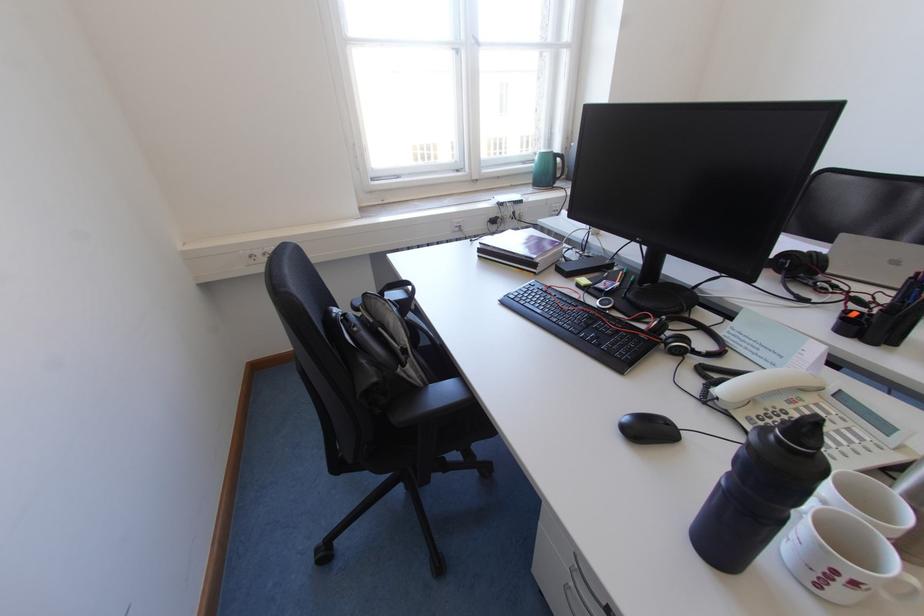
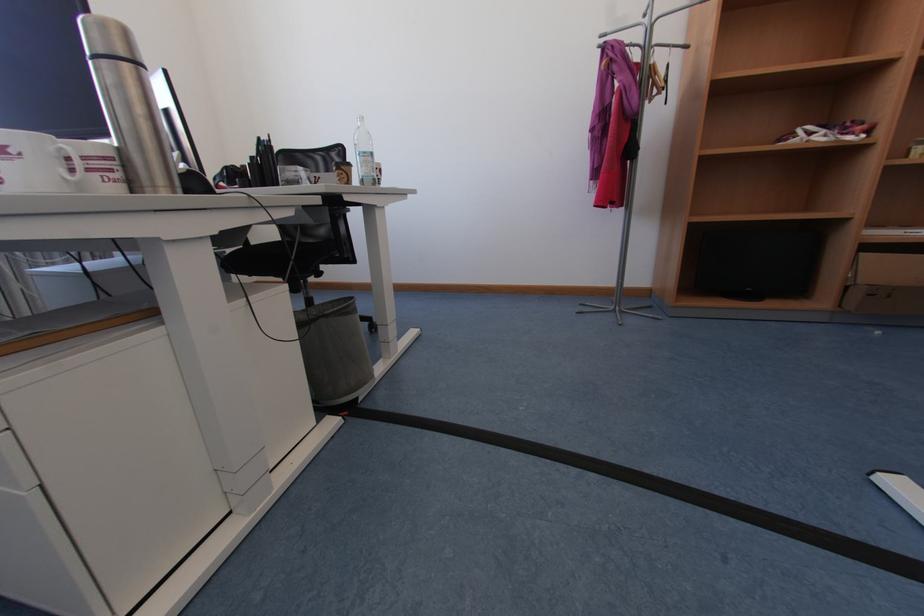
Question: The camera is either moving clockwise (left) or counter-clockwise (right) around the object. The first image is from the beginning of the video and the second image is from the end. Is the camera moving left or right when shooting the video?

Choices:
 (A) Left
 (B) Right

Answer: (A)